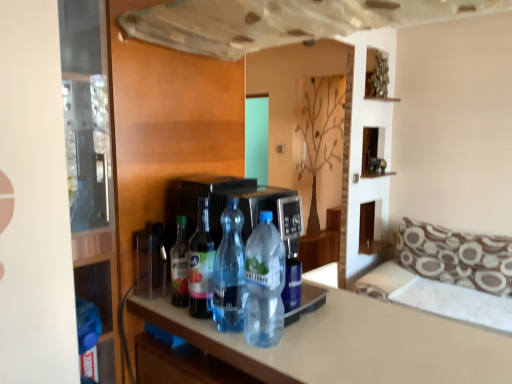
Question: Is there a large distance between brown printed fabric pillow at right and brown patterned fabric couch at right?

Choices:
 (A) no
 (B) yes

Answer: (A)

Question: Is brown printed fabric pillow at right closer to the viewer compared to brown patterned fabric couch at right?

Choices:
 (A) yes
 (B) no

Answer: (B)

Question: Is brown printed fabric pillow at right further to camera compared to brown patterned fabric couch at right?

Choices:
 (A) no
 (B) yes

Answer: (B)

Question: Is brown printed fabric pillow at right looking in the opposite direction of brown patterned fabric couch at right?

Choices:
 (A) no
 (B) yes

Answer: (B)

Question: Can you confirm if brown printed fabric pillow at right is smaller than brown patterned fabric couch at right?

Choices:
 (A) yes
 (B) no

Answer: (A)

Question: Can you confirm if brown printed fabric pillow at right is taller than brown patterned fabric couch at right?

Choices:
 (A) no
 (B) yes

Answer: (A)

Question: Could you tell me if transparent glass door at left is turned towards transparent plastic bottle at center, which is the 2th bottle in right-to-left order?

Choices:
 (A) no
 (B) yes

Answer: (A)

Question: Does transparent glass door at left have a lesser width compared to transparent plastic bottle at center, which appears as the 3th bottle when viewed from the left?

Choices:
 (A) yes
 (B) no

Answer: (B)

Question: From a real-world perspective, is transparent glass door at left on transparent plastic bottle at center, which is the 2th bottle in right-to-left order?

Choices:
 (A) yes
 (B) no

Answer: (A)

Question: Is transparent glass door at left outside transparent plastic bottle at center, which is the 2th bottle in right-to-left order?

Choices:
 (A) yes
 (B) no

Answer: (A)

Question: Is transparent glass door at left wider than transparent plastic bottle at center, which appears as the 3th bottle when viewed from the left?

Choices:
 (A) yes
 (B) no

Answer: (A)

Question: From the image's perspective, is transparent glass door at left beneath transparent plastic bottle at center, which appears as the 3th bottle when viewed from the left?

Choices:
 (A) no
 (B) yes

Answer: (A)

Question: Is brown patterned fabric couch at right touching translucent plastic bottle at center, the first bottle positioned from the left?

Choices:
 (A) yes
 (B) no

Answer: (B)